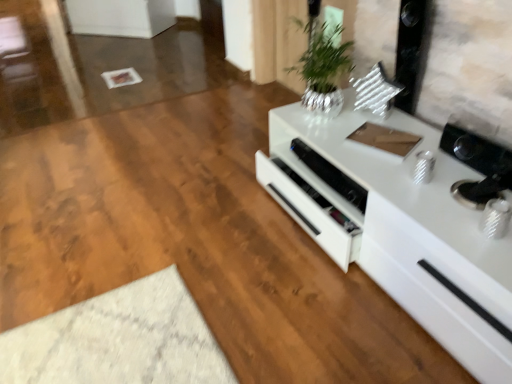
Locate an element on the screen. The image size is (512, 384). blank space above white glossy cabinet at right (from a real-world perspective) is located at coordinates (408, 174).